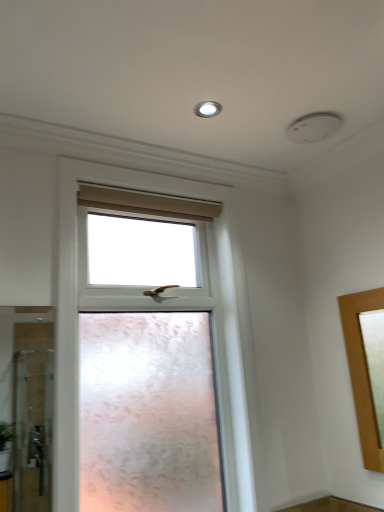
At what (x,y) coordinates should I click in order to perform the action: click on white glossy light fixture at upper center. Please return your answer as a coordinate pair (x, y). The width and height of the screenshot is (384, 512). Looking at the image, I should click on (207, 109).

What do you see at coordinates (207, 109) in the screenshot?
I see `white glossy light fixture at upper center` at bounding box center [207, 109].

What do you see at coordinates (162, 309) in the screenshot? This screenshot has width=384, height=512. I see `clear glass window at center` at bounding box center [162, 309].

Measure the distance between point (94, 176) and camera.

The depth of point (94, 176) is 5.89 feet.

Measure the distance between clear glass window at center and camera.

clear glass window at center is 1.43 meters away from camera.

Identify the location of clear glass window at center. The image size is (384, 512). (162, 309).

The height and width of the screenshot is (512, 384). Find the location of `white glossy light fixture at upper center`. white glossy light fixture at upper center is located at coordinates (207, 109).

Is white glossy light fixture at upper center at the right side of clear glass window at center?

Yes, white glossy light fixture at upper center is to the right of clear glass window at center.

Is the depth of white glossy light fixture at upper center greater than that of clear glass window at center?

Yes, white glossy light fixture at upper center is further from the viewer.

Is point (196, 113) positioned in front of point (66, 436)?

No, it is not.

From the picture: From the image's perspective, is white glossy light fixture at upper center located above clear glass window at center?

Yes, from the image's perspective, white glossy light fixture at upper center is above clear glass window at center.

From a real-world perspective, who is located lower, white glossy light fixture at upper center or clear glass window at center?

clear glass window at center, from a real-world perspective.

Which of these two, white glossy light fixture at upper center or clear glass window at center, is wider?

Wider between the two is clear glass window at center.

Is white glossy light fixture at upper center taller or shorter than clear glass window at center?

Clearly, white glossy light fixture at upper center is shorter compared to clear glass window at center.

Considering the relative sizes of white glossy light fixture at upper center and clear glass window at center in the image provided, is white glossy light fixture at upper center bigger than clear glass window at center?

No, white glossy light fixture at upper center is not bigger than clear glass window at center.

Is white glossy light fixture at upper center spatially inside clear glass window at center, or outside of it?

The correct answer is: outside.

Is white glossy light fixture at upper center placed right next to clear glass window at center?

No.

Is white glossy light fixture at upper center facing away from clear glass window at center?

white glossy light fixture at upper center does not have its back to clear glass window at center.

Find the location of a particular element. The height and width of the screenshot is (512, 384). window that is below the white glossy light fixture at upper center (from the image's perspective) is located at coordinates (162, 309).

Does clear glass window at center appear on the right side of white glossy light fixture at upper center?

No, clear glass window at center is not to the right of white glossy light fixture at upper center.

Considering the positions of objects clear glass window at center and white glossy light fixture at upper center in the image provided, who is in front, clear glass window at center or white glossy light fixture at upper center?

clear glass window at center is closer to the camera.

Between point (221, 215) and point (207, 105), which one is positioned behind?

The point (221, 215) is farther.

From the image's perspective, which is below, clear glass window at center or white glossy light fixture at upper center?

clear glass window at center appears lower in the image.

From a real-world perspective, which is physically above, clear glass window at center or white glossy light fixture at upper center?

From a 3D spatial view, white glossy light fixture at upper center is above.

Between clear glass window at center and white glossy light fixture at upper center, which one has larger width?

clear glass window at center.

Does clear glass window at center have a lesser height compared to white glossy light fixture at upper center?

No.

In the scene shown: Who is smaller, clear glass window at center or white glossy light fixture at upper center?

With smaller size is white glossy light fixture at upper center.

Can white glossy light fixture at upper center be found inside clear glass window at center?

Actually, white glossy light fixture at upper center is outside clear glass window at center.

Are clear glass window at center and white glossy light fixture at upper center far apart?

No, clear glass window at center is not far from white glossy light fixture at upper center.

Is clear glass window at center looking in the opposite direction of white glossy light fixture at upper center?

No.

How different are the orientations of clear glass window at center and white glossy light fixture at upper center in degrees?

0.366 degrees separate the facing orientations of clear glass window at center and white glossy light fixture at upper center.

The image size is (384, 512). In order to click on lighting above the clear glass window at center (from a real-world perspective) in this screenshot , I will do (x=207, y=109).

Find the location of a particular element. The width and height of the screenshot is (384, 512). lighting on the right of clear glass window at center is located at coordinates (207, 109).

Locate an element on the screen. This screenshot has width=384, height=512. window lying below the white glossy light fixture at upper center (from the image's perspective) is located at coordinates (162, 309).